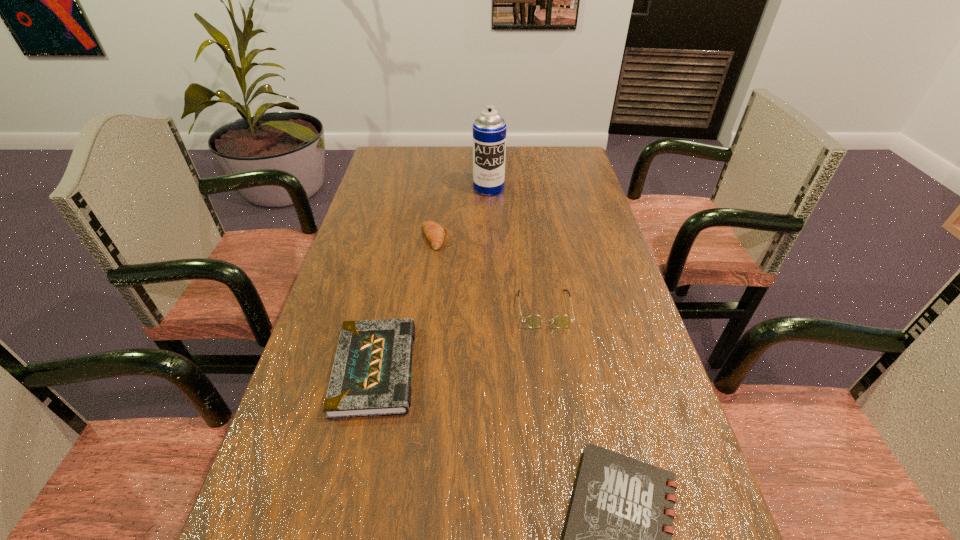
This screenshot has height=540, width=960. What are the coordinates of `blank region between the third object from right to left and the crescent roll` in the screenshot? It's located at (462, 213).

Identify the location of free space between the second shortest object and the aerosol can. The image size is (960, 540). (432, 279).

Identify which object is the second nearest to the crescent roll. Please provide its 2D coordinates. Your answer should be formatted as a tuple, i.e. [(x, y)], where the tuple contains the x and y coordinates of a point satisfying the conditions above.

[(533, 321)]

Point out which object is positioned as the nearest to the spectacles. Please provide its 2D coordinates. Your answer should be formatted as a tuple, i.e. [(x, y)], where the tuple contains the x and y coordinates of a point satisfying the conditions above.

[(371, 376)]

You are a GUI agent. You are given a task and a screenshot of the screen. Output one action in this format:
    pyautogui.click(x=<x>, y=<y>)
    Task: Click on the vacant point that satisfies the following two spatial constraints: 1. on the back side of the second shortest object; 2. on the left side of the fourth nearest object
    This screenshot has width=960, height=540.
    Given the screenshot: What is the action you would take?
    403,238